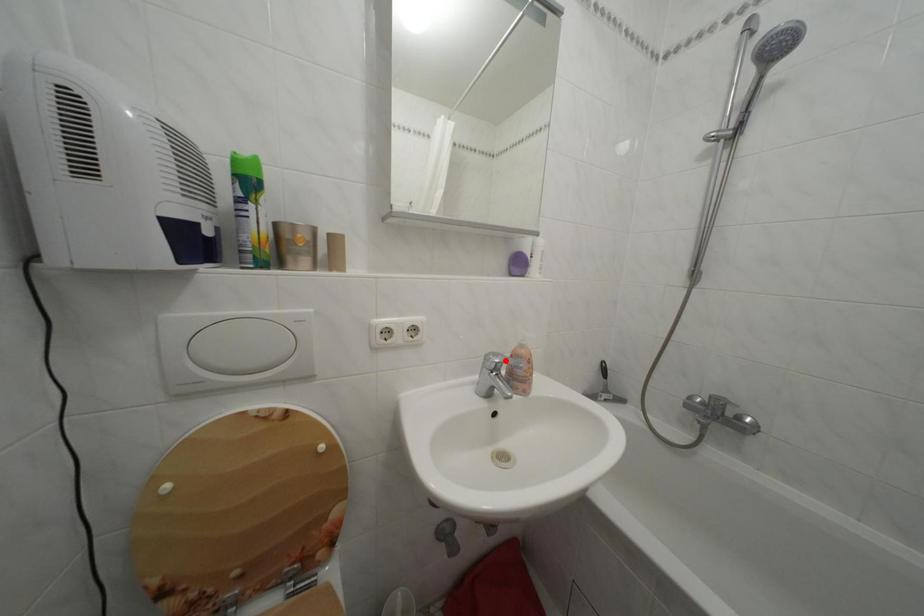
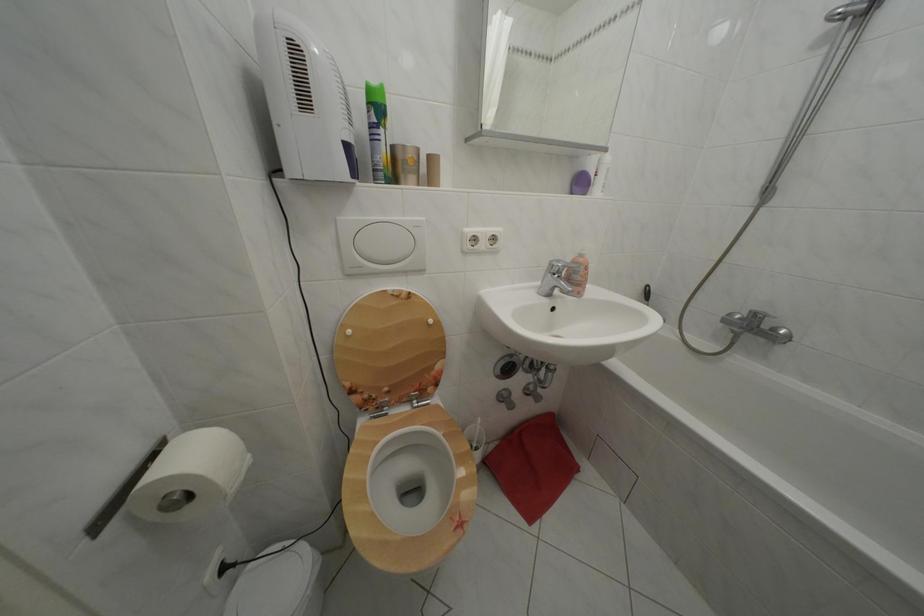
The point at the highlighted location is marked in the first image. Where is the corresponding point in the second image?

(567, 268)